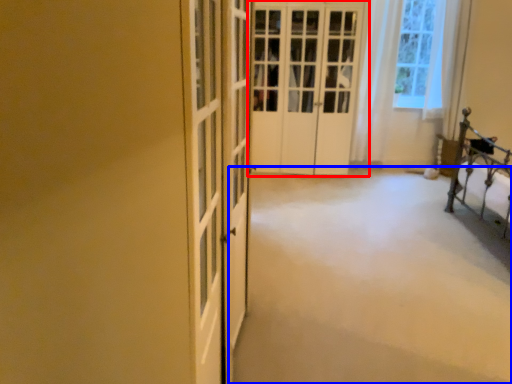
Question: Which of the following is the closest to the observer, door (highlighted by a red box) or plain (highlighted by a blue box)?

Choices:
 (A) door
 (B) plain

Answer: (B)